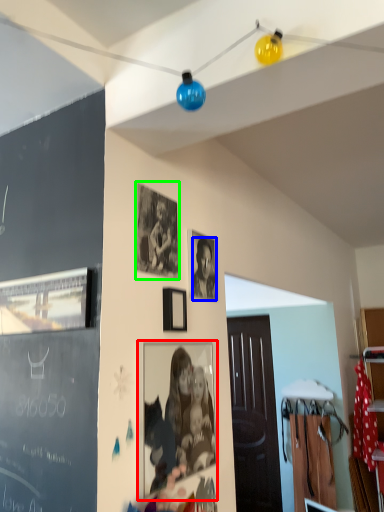
Question: Which object is the farthest from picture frame (highlighted by a red box)? Choose among these: person (highlighted by a blue box) or picture frame (highlighted by a green box).

Choices:
 (A) person
 (B) picture frame

Answer: (B)